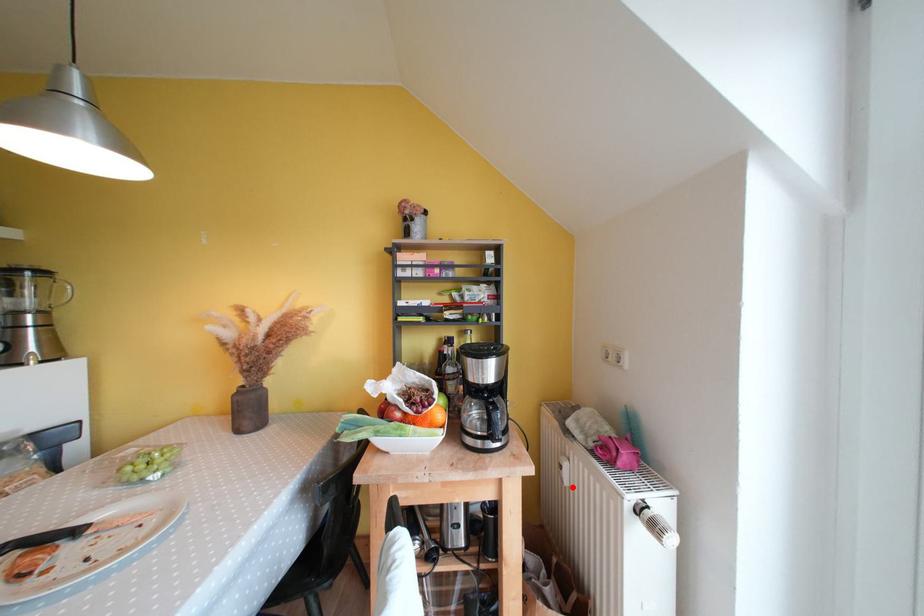
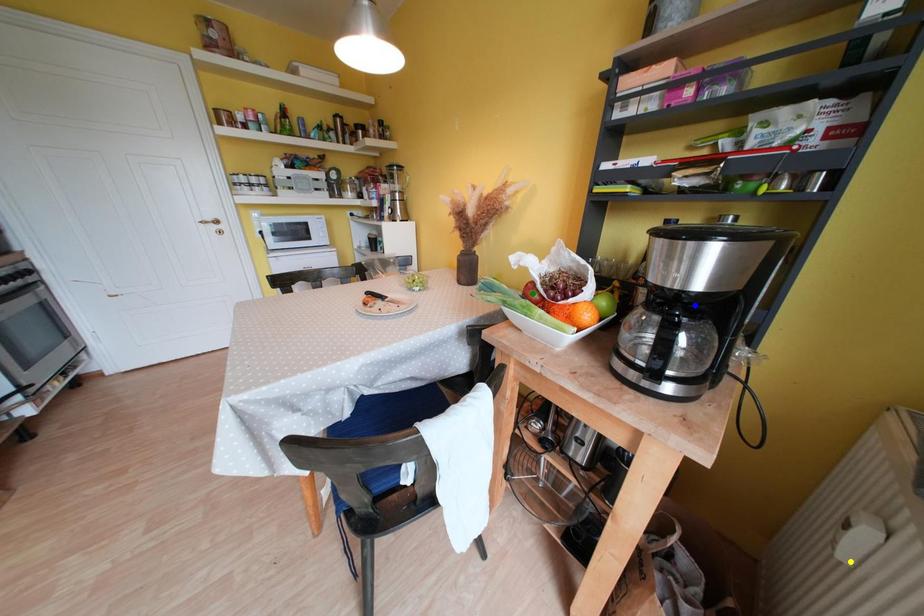
Question: I am providing you with two images of the same scene from different viewpoints. A red point is marked on the first image. You are given multiple points on the second image. Which spot in image 2 lines up with the point in image 1?

Choices:
 (A) green point
 (B) blue point
 (C) yellow point

Answer: (C)